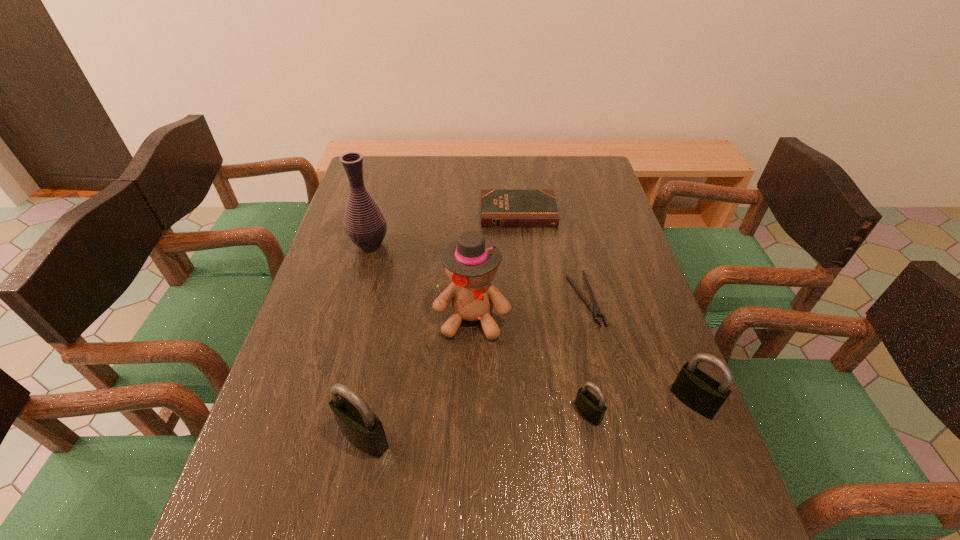
Please mark a free spot for a new padlock to balance the arrangement. Please provide its 2D coordinates. Your answer should be formatted as a tuple, i.e. [(x, y)], where the tuple contains the x and y coordinates of a point satisfying the conditions above.

[(478, 425)]